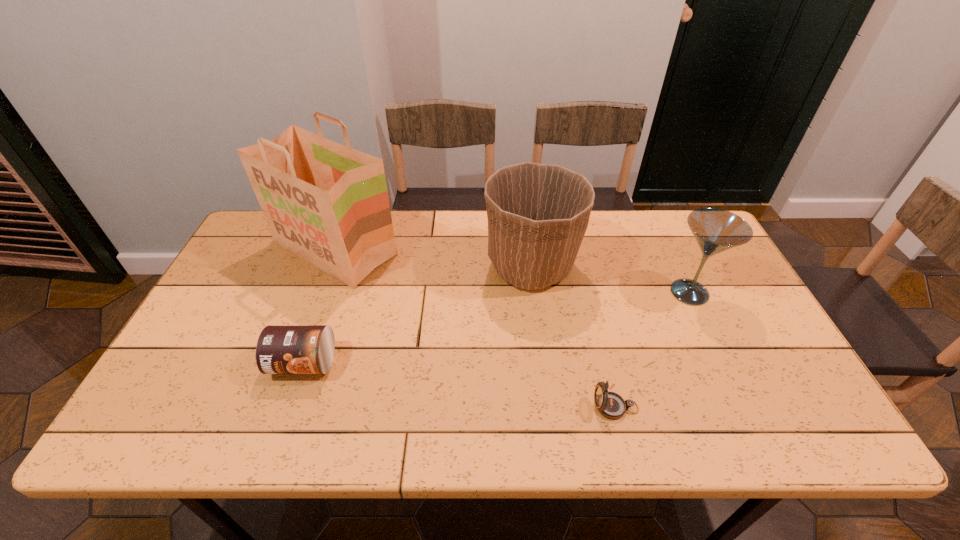
Image resolution: width=960 pixels, height=540 pixels. In order to click on vacant space at the near edge of the desktop in this screenshot , I will do `click(557, 424)`.

Identify the location of vacant space at the near left corner. (172, 422).

Where is `free space at the far right corner`? This screenshot has height=540, width=960. free space at the far right corner is located at coordinates (684, 239).

This screenshot has height=540, width=960. In order to click on free point between the tallest object and the flowerpot in this screenshot , I will do `click(433, 258)`.

This screenshot has width=960, height=540. What are the coordinates of `empty space that is in between the can and the tallest object` in the screenshot? It's located at (320, 306).

Find the location of `free space that is in between the compass and the second tallest object`. free space that is in between the compass and the second tallest object is located at coordinates (573, 337).

Locate an element on the screen. vacant area that lies between the can and the flowerpot is located at coordinates (418, 315).

At what (x,y) coordinates should I click in order to perform the action: click on free space between the can and the compass. Please return your answer as a coordinate pair (x, y). Looking at the image, I should click on (460, 385).

Find the location of a particular element. This screenshot has width=960, height=540. free space between the flowerpot and the nearest object is located at coordinates point(573,337).

Locate an element on the screen. This screenshot has height=540, width=960. free space that is in between the tallest object and the compass is located at coordinates (475, 328).